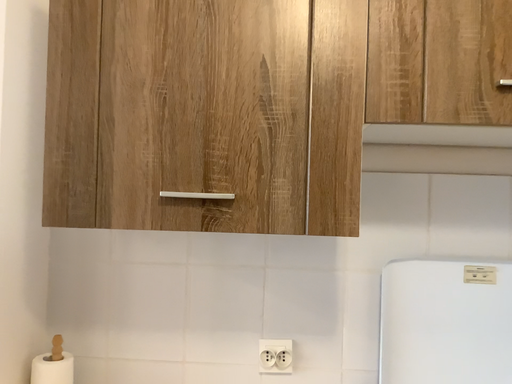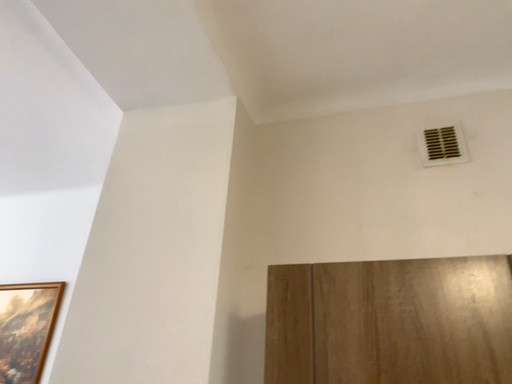
Question: How did the camera likely rotate when shooting the video?

Choices:
 (A) rotated left
 (B) rotated right

Answer: (A)